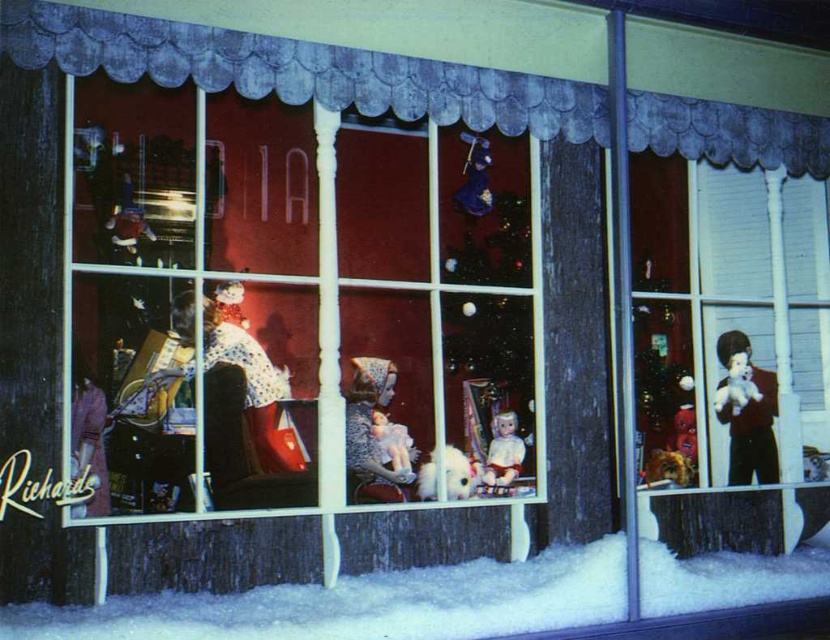
Question: Does smooth black doll at right appear over white plush doll at center?

Choices:
 (A) yes
 (B) no

Answer: (A)

Question: Which is nearer to the matte plastic doll at center?

Choices:
 (A) white plush dog at center
 (B) matte black dress at right
 (C) white fluffy snow at lower center
 (D) white plush doll at center

Answer: (A)

Question: Is white fluffy snow at lower center closer to the viewer compared to matte porcelain doll at center?

Choices:
 (A) yes
 (B) no

Answer: (A)

Question: Among these objects, which one is nearest to the camera?

Choices:
 (A) white plush dog at center
 (B) smooth black doll at right

Answer: (A)

Question: Which point is farther to the camera?

Choices:
 (A) velvet blue curtain at upper center
 (B) white plush doll at center
 (C) smooth black doll at right
 (D) white fluffy snow at lower center

Answer: (B)

Question: Can you confirm if matte plastic doll at center is thinner than matte porcelain doll at center?

Choices:
 (A) yes
 (B) no

Answer: (B)